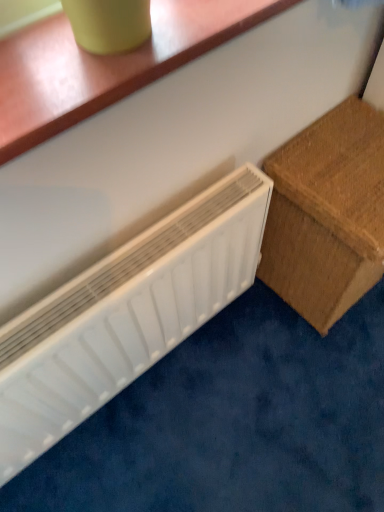
Question: Is brown woven box at right in front of or behind white plastic radiator at lower left in the image?

Choices:
 (A) behind
 (B) front

Answer: (A)

Question: Considering the positions of point (307, 316) and point (21, 367), is point (307, 316) closer or farther from the camera than point (21, 367)?

Choices:
 (A) closer
 (B) farther

Answer: (B)

Question: From the image's perspective, is brown woven box at right positioned above or below white plastic radiator at lower left?

Choices:
 (A) below
 (B) above

Answer: (B)

Question: Is white plastic radiator at lower left inside the boundaries of brown woven box at right, or outside?

Choices:
 (A) outside
 (B) inside

Answer: (A)

Question: From their relative heights in the image, would you say white plastic radiator at lower left is taller or shorter than brown woven box at right?

Choices:
 (A) tall
 (B) short

Answer: (A)

Question: Considering their positions, is white plastic radiator at lower left located in front of or behind brown woven box at right?

Choices:
 (A) front
 (B) behind

Answer: (A)

Question: Is white plastic radiator at lower left bigger or smaller than brown woven box at right?

Choices:
 (A) small
 (B) big

Answer: (A)